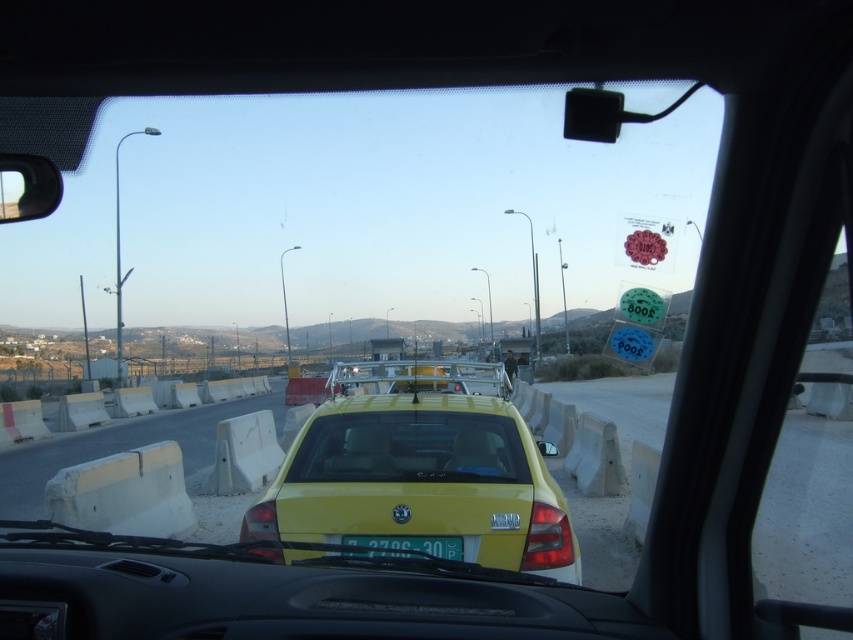
You are a delivery person who needs to place a package on the roof of the yellow matte taxi at center. The package is 1.5 meters long. Can you safely place the package on the roof without it extending beyond the transparent glass windshield at center?

The yellow matte taxi at center and transparent glass windshield at center are 1.47 meters apart from each other. Since the package is 1.5 meters long, it would extend beyond the transparent glass windshield at center, so you cannot safely place the package there.

In the scene shown: You are a passenger in the car and want to read the license plate of the yellow matte taxi at center. Can you see the yellow plastic license plate at center clearly from your current position?

The yellow matte taxi at center is taller than yellow plastic license plate at center, so the license plate might be partially obscured by the taxi itself, making it difficult to read clearly.

In the scene shown: You are a driver trying to read the license plate of the car ahead. Considering the transparent glass windshield at center and the yellow plastic license plate at center, which object might block your view of the license plate?

The transparent glass windshield at center might block your view of the yellow plastic license plate at center since it is wider than the license plate.